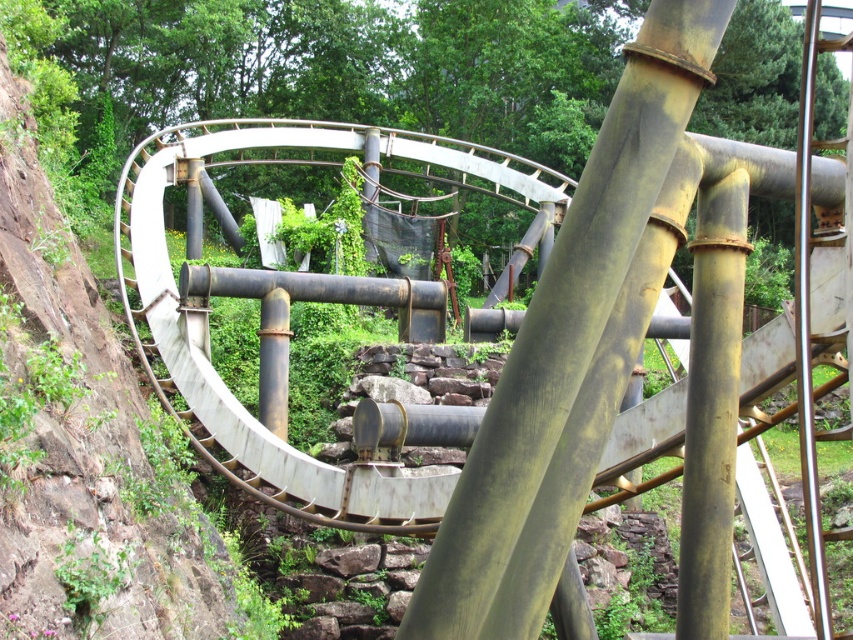
You are a maintenance worker inspecting the roller coaster. You notice the white matte roller coaster at upper left and the rusty metal pipe at center. Which object is positioned higher from the ground?

The rusty metal pipe at center is positioned higher from the ground than the white matte roller coaster at upper left because the white matte roller coaster at upper left is located below it.

You are standing at the base of the roller coaster track and want to determine which of the two points, point (122, 637) or point (631, 128), is closer to you. Which point is nearer?

Point (122, 637) is further to the viewer than point (631, 128), so the closer point to you is point (631, 128).